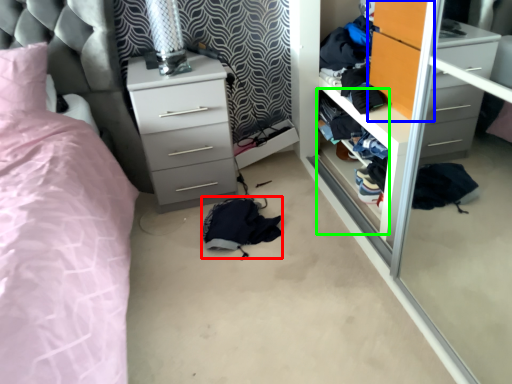
Question: Considering the real-world distances, which object is closest to clothing (highlighted by a red box)? armoire (highlighted by a blue box) or shelf (highlighted by a green box).

Choices:
 (A) armoire
 (B) shelf

Answer: (B)